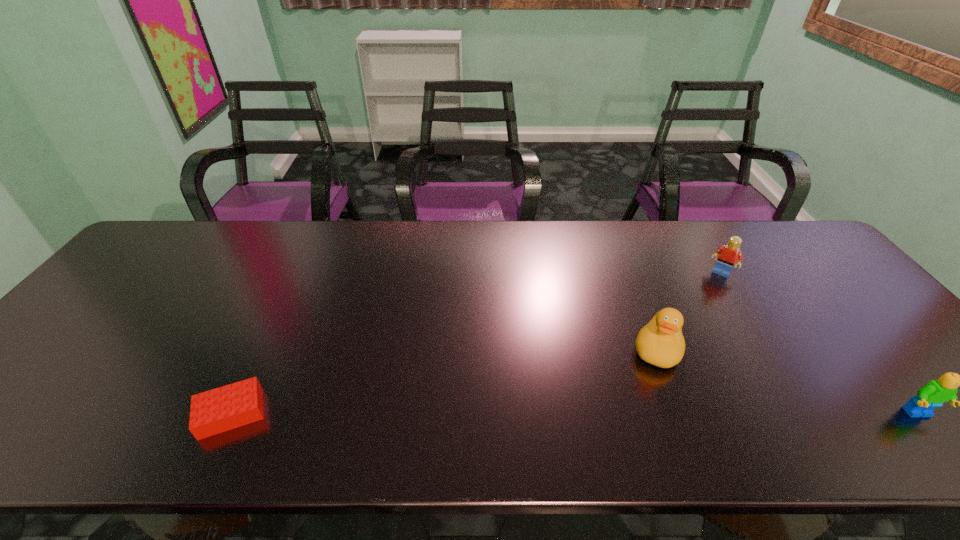
Where is `the shortest object`? the shortest object is located at coordinates (218, 410).

Where is `the shortest Lego`? The width and height of the screenshot is (960, 540). the shortest Lego is located at coordinates (218, 410).

In order to click on the rightmost Lego in this screenshot , I will do `click(936, 392)`.

The width and height of the screenshot is (960, 540). Identify the location of duck. (661, 343).

Find the location of `the third nearest object`. the third nearest object is located at coordinates (661, 343).

Where is `the second Lego from right to left`? The width and height of the screenshot is (960, 540). the second Lego from right to left is located at coordinates (729, 254).

Locate an element on the screen. the farthest object is located at coordinates (729, 254).

Locate an element on the screen. The height and width of the screenshot is (540, 960). vacant region located on the left of the leftmost object is located at coordinates point(140,413).

You are a GUI agent. You are given a task and a screenshot of the screen. Output one action in this format:
    pyautogui.click(x=<x>, y=<y>)
    Task: Click on the blank space located 0.070m on the face of the second object from left to right
    The width and height of the screenshot is (960, 540).
    Given the screenshot: What is the action you would take?
    pyautogui.click(x=646, y=393)

Identify the location of vacant space positioned on the front-facing side of the third object from left to right. (664, 364).